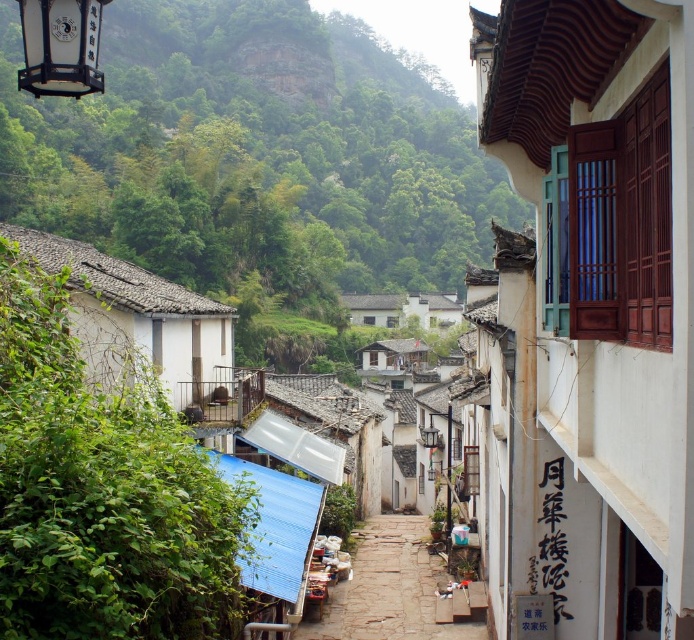
Question: Which point appears farthest from the camera in this image?

Choices:
 (A) (591, 72)
 (B) (108, 310)
 (C) (101, 3)
 (D) (403, 630)

Answer: (D)

Question: Which of the following is the farthest from the observer?

Choices:
 (A) click(x=421, y=579)
 (B) click(x=53, y=252)
 (C) click(x=62, y=3)
 (D) click(x=558, y=65)

Answer: (A)

Question: Is white wooden window at upper right to the right of stone paved alley at center from the viewer's perspective?

Choices:
 (A) yes
 (B) no

Answer: (A)

Question: Which object is positioned closest to the matte black lantern at upper left?

Choices:
 (A) white wooden window at upper right
 (B) white tile hut at center

Answer: (B)

Question: Does white wooden window at upper right come in front of white tile hut at center?

Choices:
 (A) yes
 (B) no

Answer: (A)

Question: Where is white tile hut at center located in relation to stone paved alley at center in the image?

Choices:
 (A) below
 (B) above

Answer: (B)